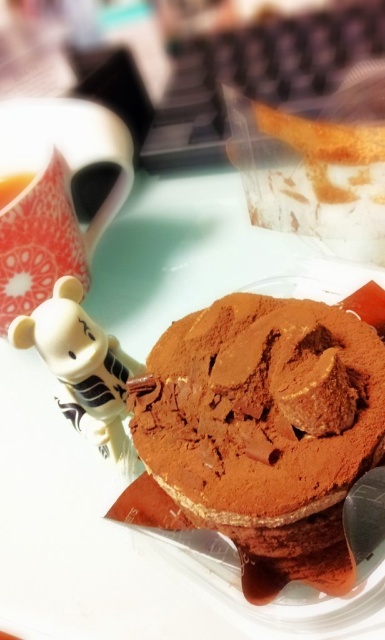
Question: Which object is farther from the camera taking this photo?

Choices:
 (A) chocolatesmoothcake at center
 (B) matte white teacup at upper left
 (C) white matte bear at left

Answer: (B)

Question: Which point is closer to the camera?

Choices:
 (A) chocolatesmoothcake at center
 (B) matte white teacup at upper left
 (C) white matte bear at left

Answer: (A)

Question: Can you confirm if white matte bear at left is bigger than matte white teacup at upper left?

Choices:
 (A) no
 (B) yes

Answer: (B)

Question: Which object is closer to the camera taking this photo?

Choices:
 (A) white matte bear at left
 (B) chocolatesmoothcake at center

Answer: (B)

Question: Does chocolatesmoothcake at center appear on the left side of matte white teacup at upper left?

Choices:
 (A) yes
 (B) no

Answer: (B)

Question: Does white matte bear at left have a lesser width compared to matte white teacup at upper left?

Choices:
 (A) yes
 (B) no

Answer: (B)